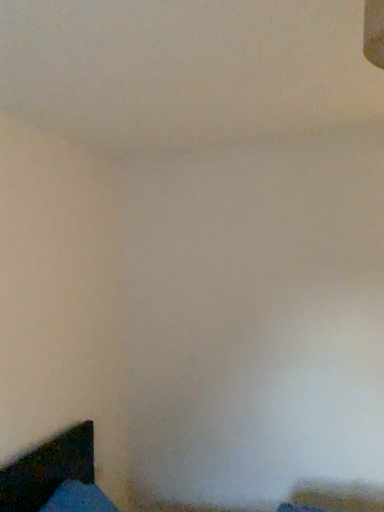
This screenshot has height=512, width=384. In order to click on dark wood bed at lower left in this screenshot , I will do `click(55, 476)`.

The width and height of the screenshot is (384, 512). What do you see at coordinates (55, 476) in the screenshot? I see `dark wood bed at lower left` at bounding box center [55, 476].

Locate an element on the screen. This screenshot has height=512, width=384. dark wood bed at lower left is located at coordinates (55, 476).